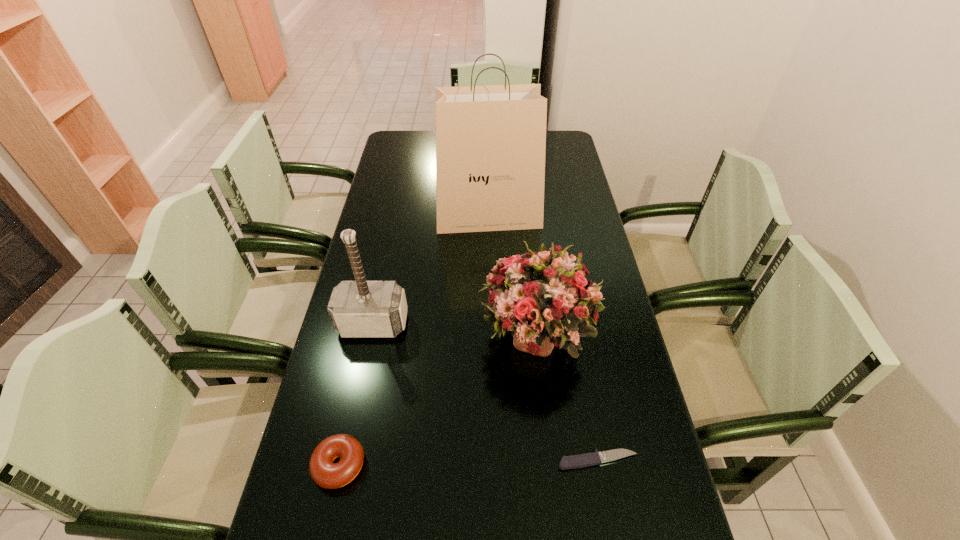
Identify the location of vacant region that satisfies the following two spatial constraints: 1. for striking with the head of the shortest object; 2. on the right side of the fourth shortest object. This screenshot has width=960, height=540. (345, 460).

At what (x,y) coordinates should I click in order to perform the action: click on vacant space that satisfies the following two spatial constraints: 1. for striking with the head of the bouquet; 2. on the right side of the fourth shortest object. Please return your answer as a coordinate pair (x, y). Looking at the image, I should click on (371, 335).